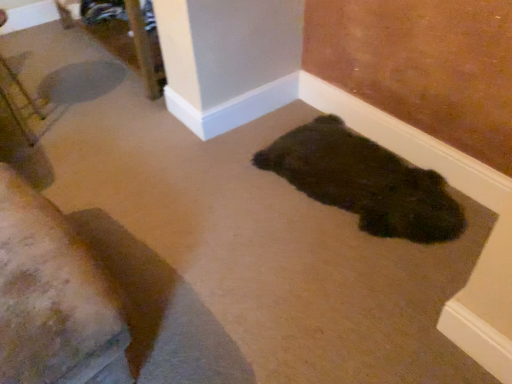
The image size is (512, 384). What do you see at coordinates (364, 182) in the screenshot?
I see `dark fur rug at center` at bounding box center [364, 182].

In order to face dark fur rug at center, should I rotate leftwards or rightwards?

Rotate your view right by about 13.186°.

Locate an element on the screen. dark fur rug at center is located at coordinates (364, 182).

Where is `dark fur rug at center`? dark fur rug at center is located at coordinates (364, 182).